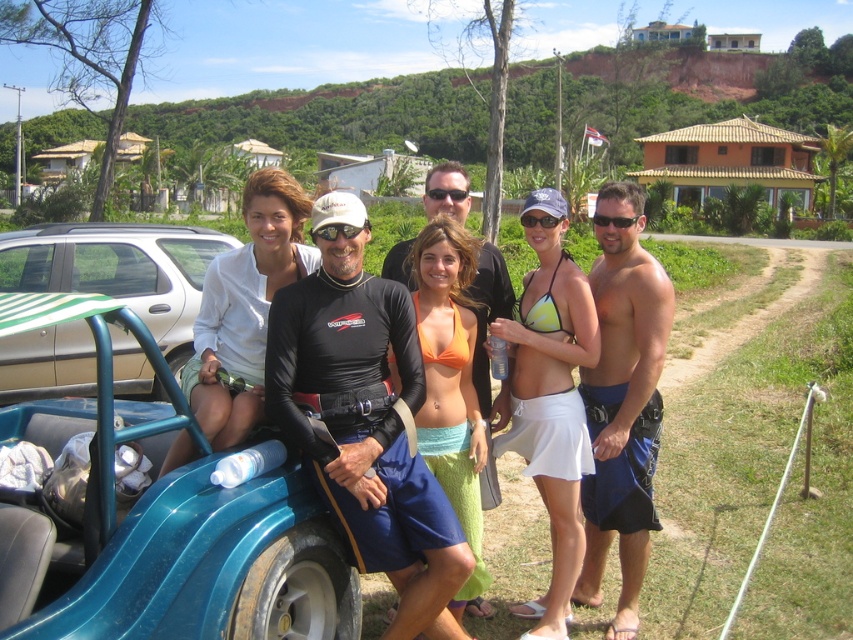
You are a photographer trying to capture a clear shot of the black matte goggles at center. However, the black matte sunglasses at center is blocking your view. Can you adjust your angle to see the goggles without moving the objects?

The black matte sunglasses at center is above the black matte goggles at center, so if you lower your angle slightly, you can see the goggles below the sunglasses.

You are a photographer trying to capture a closeup of the shiny blue shorts at center and the black matte goggles at center. Which object should you zoom in on to ensure both are clearly visible in the frame?

The shiny blue shorts at center has a larger size compared to the black matte goggles at center, so you should zoom in on the shiny blue shorts at center to ensure both objects are clearly visible in the frame.